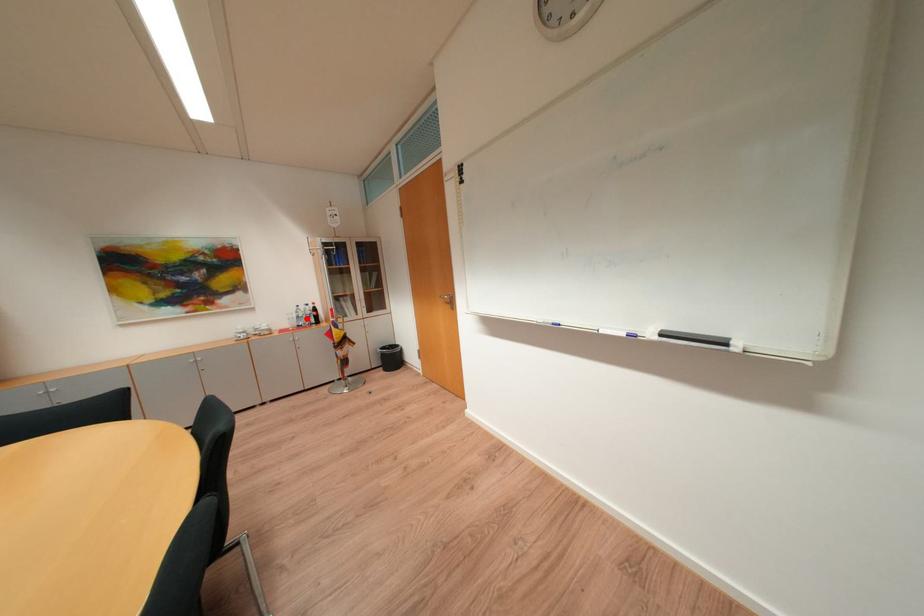
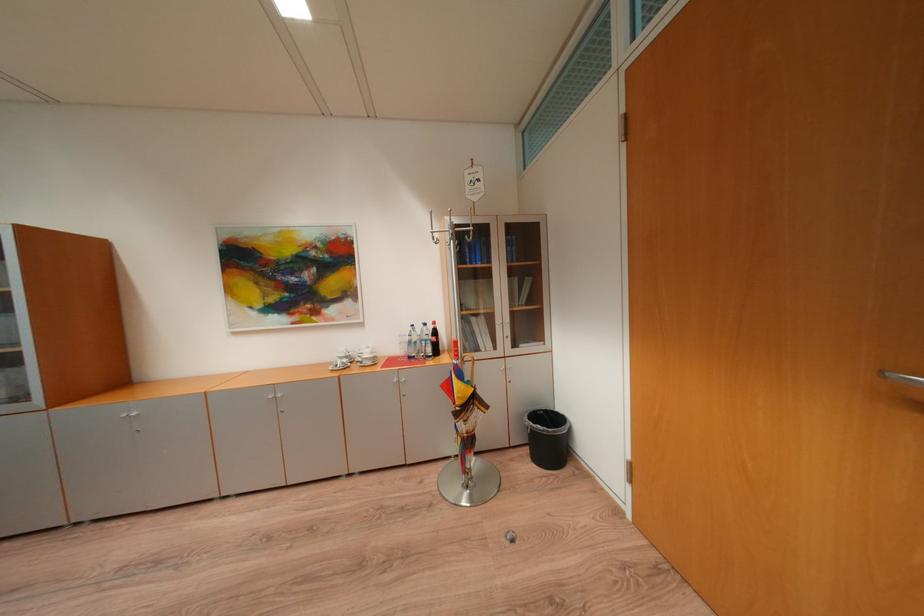
Question: I am providing you with two images of the same scene from different viewpoints. A red point is marked on the first image. Is the red point's position out of view in image 2?

Choices:
 (A) Yes
 (B) No

Answer: (B)